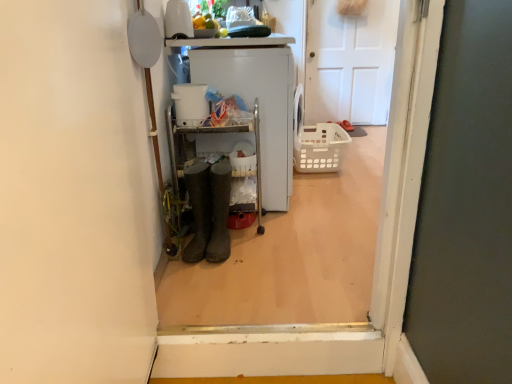
Question: Is translucent plastic basket at center aimed at brown rubber boots at center, which appears as the 2th footwear when viewed from the left?

Choices:
 (A) yes
 (B) no

Answer: (B)

Question: Can you confirm if translucent plastic basket at center is taller than brown rubber boots at center, which appears as the 2th footwear when viewed from the left?

Choices:
 (A) yes
 (B) no

Answer: (B)

Question: Is translucent plastic basket at center not near brown rubber boots at center, arranged as the 1th footwear when viewed from the right?

Choices:
 (A) no
 (B) yes

Answer: (B)

Question: From the image's perspective, is translucent plastic basket at center located above brown rubber boots at center, arranged as the 1th footwear when viewed from the right?

Choices:
 (A) yes
 (B) no

Answer: (A)

Question: Is translucent plastic basket at center touching brown rubber boots at center, which appears as the 2th footwear when viewed from the left?

Choices:
 (A) yes
 (B) no

Answer: (B)

Question: Is translucent plastic basket at center turned away from brown rubber boots at center, which appears as the 2th footwear when viewed from the left?

Choices:
 (A) no
 (B) yes

Answer: (A)

Question: From a real-world perspective, is translucent plastic basket at center physically below matte rubber boots at center?

Choices:
 (A) no
 (B) yes

Answer: (B)

Question: From the image's perspective, is translucent plastic basket at center beneath matte rubber boots at center?

Choices:
 (A) yes
 (B) no

Answer: (B)

Question: Can you confirm if translucent plastic basket at center is positioned to the right of matte rubber boots at center?

Choices:
 (A) yes
 (B) no

Answer: (A)

Question: Is translucent plastic basket at center directly adjacent to matte rubber boots at center?

Choices:
 (A) yes
 (B) no

Answer: (B)

Question: Is translucent plastic basket at center at the left side of matte rubber boots at center?

Choices:
 (A) no
 (B) yes

Answer: (A)

Question: Would you consider translucent plastic basket at center to be distant from matte rubber boots at center?

Choices:
 (A) yes
 (B) no

Answer: (A)

Question: Does brown rubber boots at center, which appears as the 2th footwear when viewed from the left, have a larger size compared to white plastic washing machine at center?

Choices:
 (A) yes
 (B) no

Answer: (B)